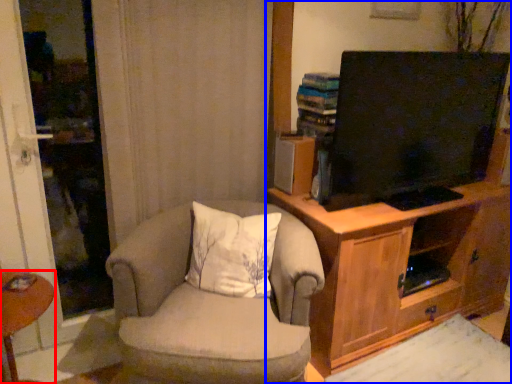
Question: Which object appears farthest to the camera in this image, desk (highlighted by a red box) or cabinetry (highlighted by a blue box)?

Choices:
 (A) desk
 (B) cabinetry

Answer: (B)